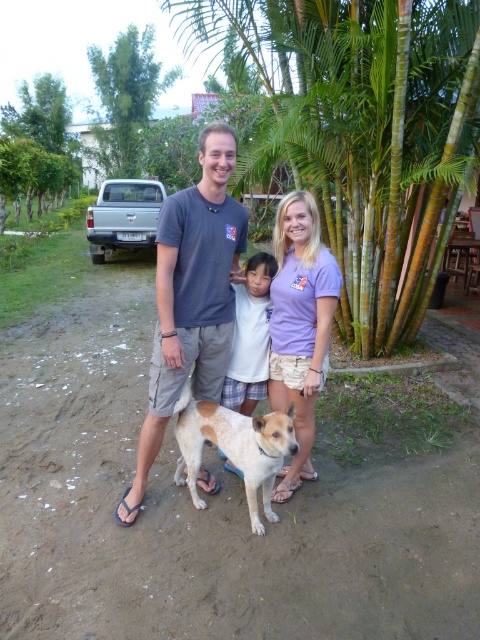
Can you confirm if green leafy palm tree at center is bigger than lavender cotton t-shirt at center?

Yes, green leafy palm tree at center is bigger than lavender cotton t-shirt at center.

Is green leafy palm tree at center taller than lavender cotton t-shirt at center?

Yes, green leafy palm tree at center is taller than lavender cotton t-shirt at center.

Find the location of a particular element. green leafy palm tree at center is located at coordinates (361, 129).

Who is positioned more to the left, dark gray t-shirt at center or lavender cotton t-shirt at center?

Positioned to the left is dark gray t-shirt at center.

Does point (201, 140) come closer to viewer compared to point (292, 211)?

Yes, point (201, 140) is closer to viewer.

Is point (152, 364) positioned in front of point (285, 260)?

Yes, it is.

In order to click on dark gray t-shirt at center in this screenshot , I will do `click(192, 298)`.

From the picture: Which is more to the left, green leafy palm tree at center or white cotton shirt at center?

green leafy palm tree at center

Image resolution: width=480 pixels, height=640 pixels. In order to click on green leafy palm tree at center in this screenshot , I will do `click(361, 129)`.

Where is `green leafy palm tree at center`? green leafy palm tree at center is located at coordinates (361, 129).